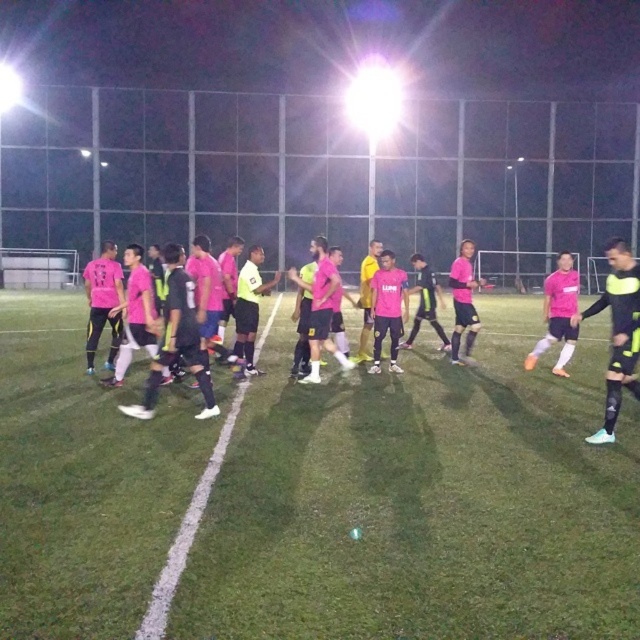
Question: Which of the following is the farthest from the observer?

Choices:
 (A) pink matte jersey at left
 (B) green grass football field at center

Answer: (A)

Question: Which object is farther from the camera taking this photo?

Choices:
 (A) pink matte jersey at left
 (B) green grass football field at center

Answer: (A)

Question: Which point is farther from the camera taking this photo?

Choices:
 (A) (634, 321)
 (B) (19, 301)

Answer: (B)

Question: Observing the image, what is the correct spatial positioning of green grass football field at center in reference to pink matte jersey at left?

Choices:
 (A) right
 (B) left

Answer: (B)

Question: Is green grass football field at center to the right of pink matte jersey at left from the viewer's perspective?

Choices:
 (A) yes
 (B) no

Answer: (B)

Question: Is green grass football field at center wider than pink matte jersey at left?

Choices:
 (A) no
 (B) yes

Answer: (A)